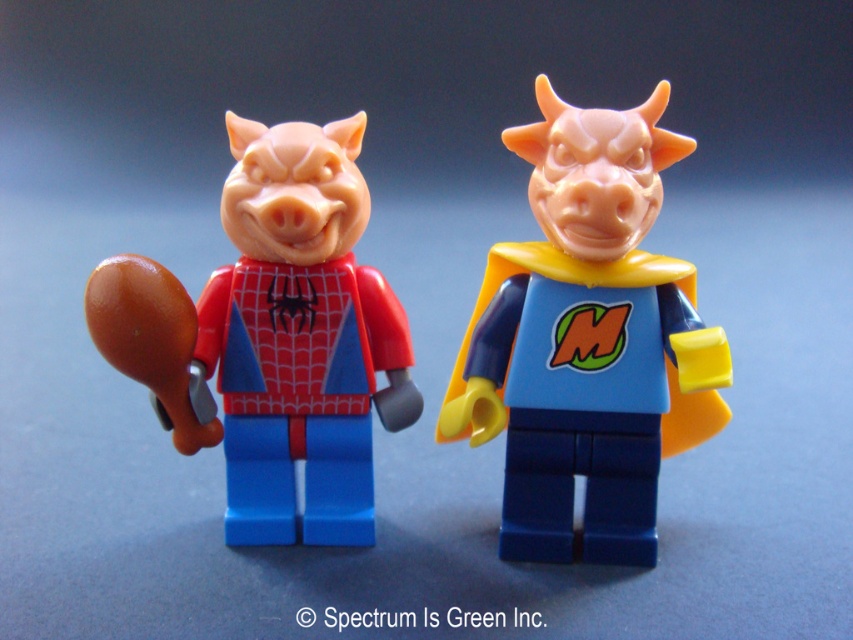
Question: From the image, what is the correct spatial relationship of matte plastic minifigure at right in relation to matte plastic pig at center?

Choices:
 (A) left
 (B) right

Answer: (B)

Question: Is matte plastic minifigure at right thinner than matte plastic pig at center?

Choices:
 (A) no
 (B) yes

Answer: (A)

Question: Which of the following is the farthest from the observer?

Choices:
 (A) matte plastic pig at center
 (B) matte plastic minifigure at right

Answer: (B)

Question: Is matte plastic minifigure at right thinner than matte plastic pig at center?

Choices:
 (A) yes
 (B) no

Answer: (B)

Question: Which point is farther to the camera?

Choices:
 (A) (575, 237)
 (B) (100, 268)

Answer: (A)